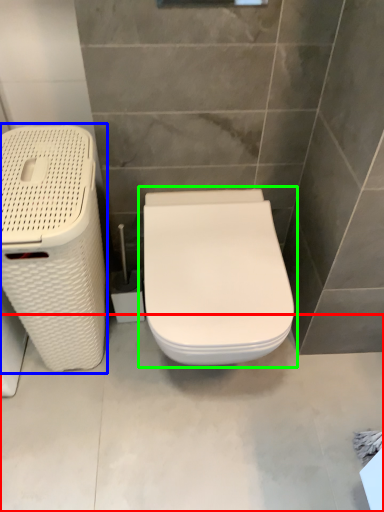
Question: Estimate the real-world distances between objects in this image. Which object is closer to concrete (highlighted by a red box), laundry basket (highlighted by a blue box) or toilet (highlighted by a green box)?

Choices:
 (A) laundry basket
 (B) toilet

Answer: (B)